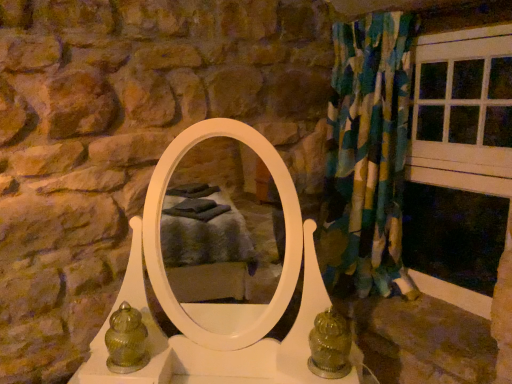
Question: Is green glass vase at lower left placed right next to white wood window frame at right?

Choices:
 (A) no
 (B) yes

Answer: (A)

Question: From the image's perspective, is green glass vase at lower left on white wood window frame at right?

Choices:
 (A) no
 (B) yes

Answer: (A)

Question: Can you confirm if green glass vase at lower left is thinner than white wood window frame at right?

Choices:
 (A) yes
 (B) no

Answer: (B)

Question: Is green glass vase at lower left aimed at white wood window frame at right?

Choices:
 (A) no
 (B) yes

Answer: (A)

Question: From the image's perspective, is green glass vase at lower left below white wood window frame at right?

Choices:
 (A) no
 (B) yes

Answer: (B)

Question: Is green glass vase at lower left wider than white wood window frame at right?

Choices:
 (A) no
 (B) yes

Answer: (B)

Question: Considering the relative positions of white wood window frame at right and green glass vase at lower left in the image provided, is white wood window frame at right to the left of green glass vase at lower left from the viewer's perspective?

Choices:
 (A) no
 (B) yes

Answer: (A)

Question: From the image's perspective, would you say white wood window frame at right is shown under green glass vase at lower left?

Choices:
 (A) no
 (B) yes

Answer: (A)

Question: Does white wood window frame at right come in front of green glass vase at lower left?

Choices:
 (A) yes
 (B) no

Answer: (B)

Question: Is white wood window frame at right positioned with its back to green glass vase at lower left?

Choices:
 (A) yes
 (B) no

Answer: (B)

Question: Is white wood window frame at right shorter than green glass vase at lower left?

Choices:
 (A) yes
 (B) no

Answer: (B)

Question: Is white wood window frame at right far away from green glass vase at lower left?

Choices:
 (A) yes
 (B) no

Answer: (A)

Question: Is green glass vase at lower left next to textured fabric curtain at right?

Choices:
 (A) yes
 (B) no

Answer: (B)